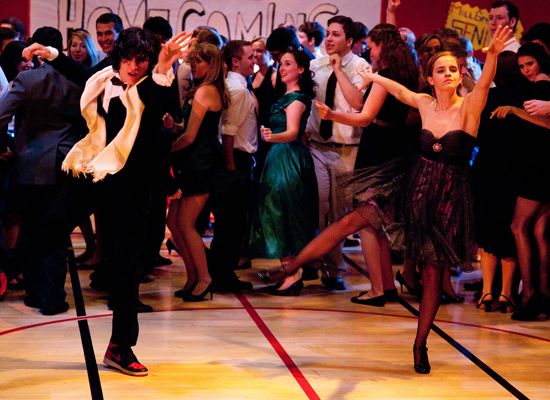
In order to click on wall in this screenshot , I will do `click(418, 9)`.